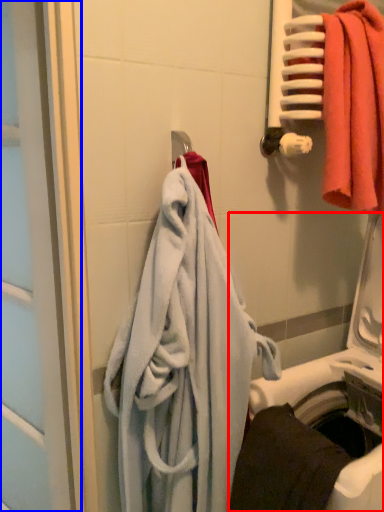
Question: Which of the following is the farthest to the observer, washing machine (highlighted by a red box) or screen door (highlighted by a blue box)?

Choices:
 (A) washing machine
 (B) screen door

Answer: (B)